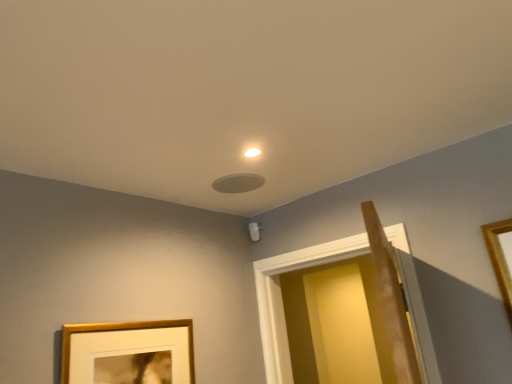
Question: Should I look upward or downward to see wooden framed picture at lower left?

Choices:
 (A) up
 (B) down

Answer: (B)